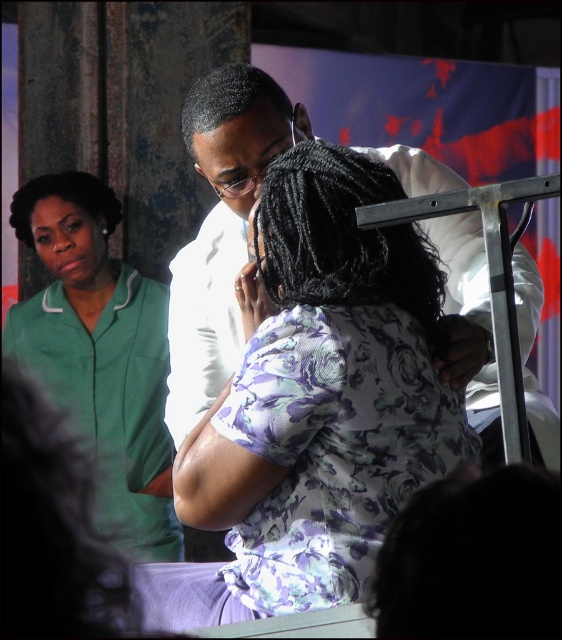
You are a photographer at the event and want to capture a photo of both the white smooth shirt at center and the green uniform at left in the same frame. Based on their heights, which person should you position closer to the camera to ensure both are fully visible?

The white smooth shirt at center is not as tall as the green uniform at left. To ensure both are fully visible in the photo, position the white smooth shirt at center closer to the camera since it is shorter, allowing the photographer to capture the full height of both individuals without one being cropped out.